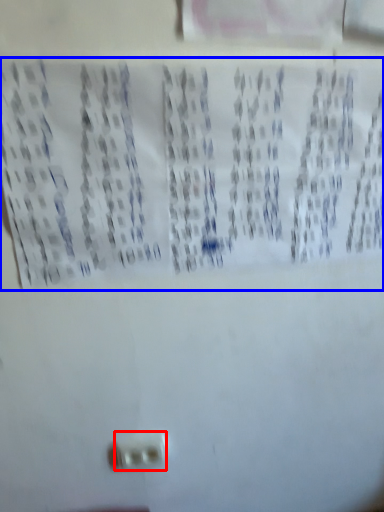
Question: Which object appears closest to the camera in this image, power plugs and sockets (highlighted by a red box) or print (highlighted by a blue box)?

Choices:
 (A) power plugs and sockets
 (B) print

Answer: (B)